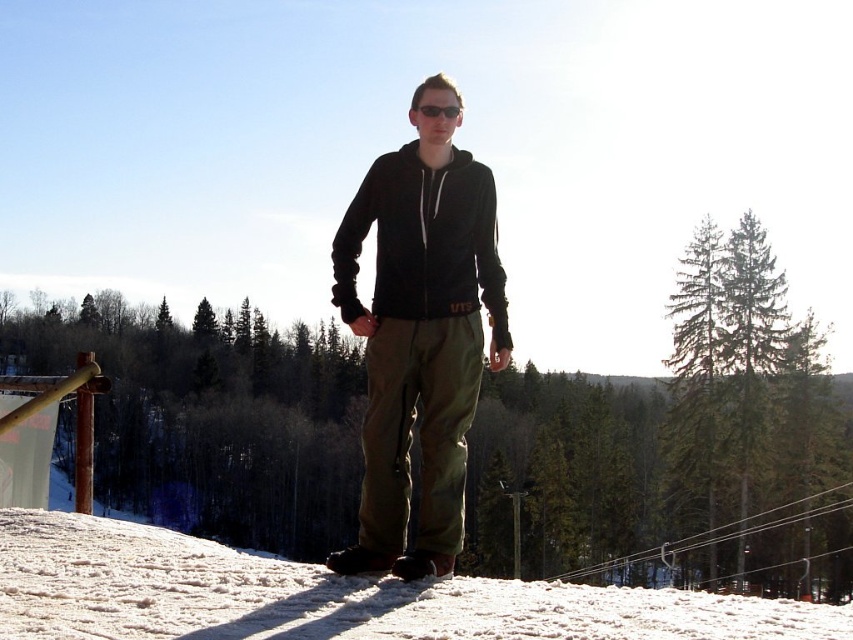
Can you confirm if white snow at lower center is positioned to the right of black fleece sweatshirt at center?

No, white snow at lower center is not to the right of black fleece sweatshirt at center.

Can you confirm if white snow at lower center is wider than black fleece sweatshirt at center?

Indeed, white snow at lower center has a greater width compared to black fleece sweatshirt at center.

In order to click on white snow at lower center in this screenshot , I will do `click(329, 596)`.

You are a GUI agent. You are given a task and a screenshot of the screen. Output one action in this format:
    pyautogui.click(x=<x>, y=<y>)
    Task: Click on the white snow at lower center
    This screenshot has width=853, height=640.
    Given the screenshot: What is the action you would take?
    pyautogui.click(x=329, y=596)

Can you confirm if white snow at lower center is positioned to the left of matte black hoodie at center?

Correct, you'll find white snow at lower center to the left of matte black hoodie at center.

This screenshot has width=853, height=640. Identify the location of white snow at lower center. (329, 596).

Find the location of a particular element. This screenshot has width=853, height=640. white snow at lower center is located at coordinates (329, 596).

Is matte black hoodie at center bigger than black fleece sweatshirt at center?

Yes.

Can you confirm if matte black hoodie at center is positioned to the right of black fleece sweatshirt at center?

Incorrect, matte black hoodie at center is not on the right side of black fleece sweatshirt at center.

You are a GUI agent. You are given a task and a screenshot of the screen. Output one action in this format:
    pyautogui.click(x=<x>, y=<y>)
    Task: Click on the matte black hoodie at center
    
    Given the screenshot: What is the action you would take?
    pyautogui.click(x=421, y=332)

Image resolution: width=853 pixels, height=640 pixels. Identify the location of matte black hoodie at center. (421, 332).